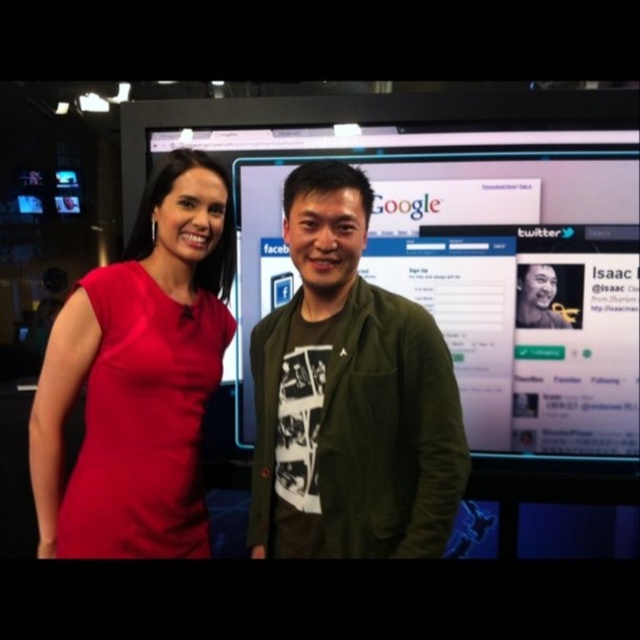
You are a photographer in the studio and want to place a small prop at the exact center of the image. The green textured jacket at center is already positioned at point (349, 396). Is this point the correct location for the center of the image?

Yes, the green textured jacket at center is positioned at point (349, 396), which is the exact center of the image.

You are organizing a photoshoot and need to determine the spatial arrangement of the green textured jacket at center and the matte red dress at left based on their sizes. Which object should be placed first in a sequence from largest to smallest?

The green textured jacket at center should be placed first in the sequence because it is larger in size than the matte red dress at left.